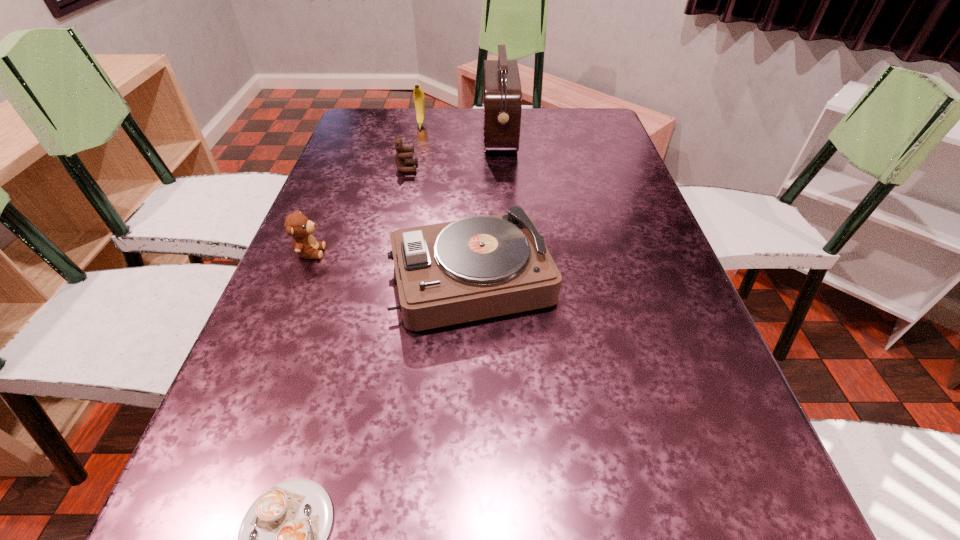
The width and height of the screenshot is (960, 540). Find the location of `free space at the far left corner of the desktop`. free space at the far left corner of the desktop is located at coordinates (378, 131).

Identify the location of vacant area that lies between the tallest object and the fifth shortest object. This screenshot has width=960, height=540. (460, 130).

Find the location of a particular element. vacant space that's between the banana and the tallest object is located at coordinates (460, 130).

Image resolution: width=960 pixels, height=540 pixels. In order to click on blank region between the leftmost object and the fifth shortest object in this screenshot , I will do `click(366, 189)`.

Locate an element on the screen. The height and width of the screenshot is (540, 960). vacant region between the tallest object and the right teddy bear is located at coordinates (453, 152).

I want to click on unoccupied area between the record player and the fifth shortest object, so click(445, 202).

Find the location of a particular element. The width and height of the screenshot is (960, 540). object that ranks as the fifth closest to the left teddy bear is located at coordinates (419, 99).

Select which object appears as the closest to the banana. Please provide its 2D coordinates. Your answer should be formatted as a tuple, i.e. [(x, y)], where the tuple contains the x and y coordinates of a point satisfying the conditions above.

[(502, 87)]

What are the coordinates of `blank area in the image that satisfies the following two spatial constraints: 1. on the back side of the record player; 2. on the face of the nearer teddy bear` in the screenshot? It's located at (471, 252).

The width and height of the screenshot is (960, 540). I want to click on blank area in the image that satisfies the following two spatial constraints: 1. on the face of the leftmost object; 2. on the back side of the record player, so click(300, 280).